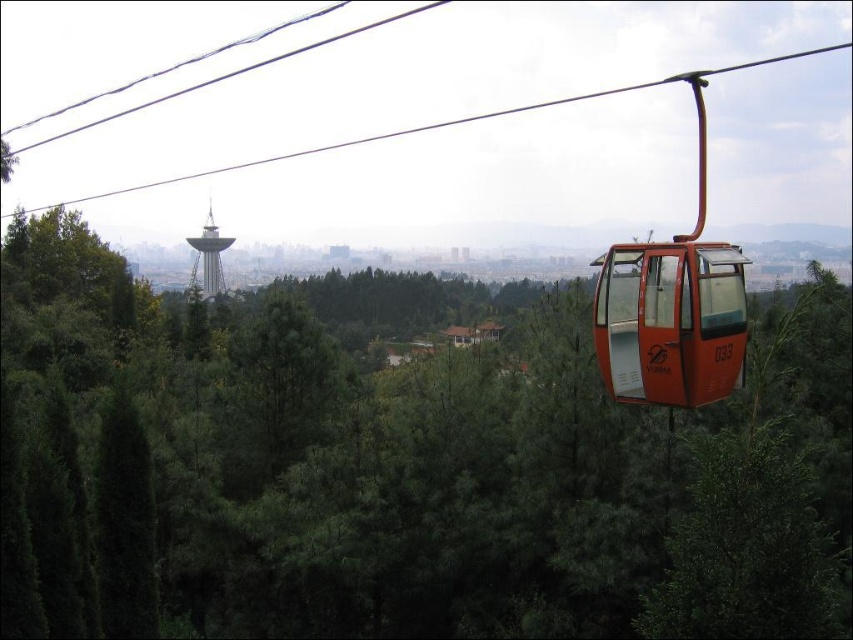
Question: Which object appears closest to the camera in this image?

Choices:
 (A) metallic silver tower at center
 (B) orange matte/glossy cable car at right

Answer: (B)

Question: Which object is positioned closest to the orange matte/glossy cable car at right?

Choices:
 (A) orange cable car at upper center
 (B) metallic silver tower at center

Answer: (B)

Question: Does orange matte/glossy cable car at right have a smaller size compared to orange cable car at upper center?

Choices:
 (A) no
 (B) yes

Answer: (B)

Question: Which point appears closest to the camera in this image?

Choices:
 (A) (607, 321)
 (B) (851, 44)
 (C) (206, 214)

Answer: (A)

Question: Is orange matte/glossy cable car at right thinner than orange cable car at upper center?

Choices:
 (A) yes
 (B) no

Answer: (A)

Question: Where is orange cable car at upper center located in relation to metallic silver tower at center in the image?

Choices:
 (A) left
 (B) right

Answer: (B)